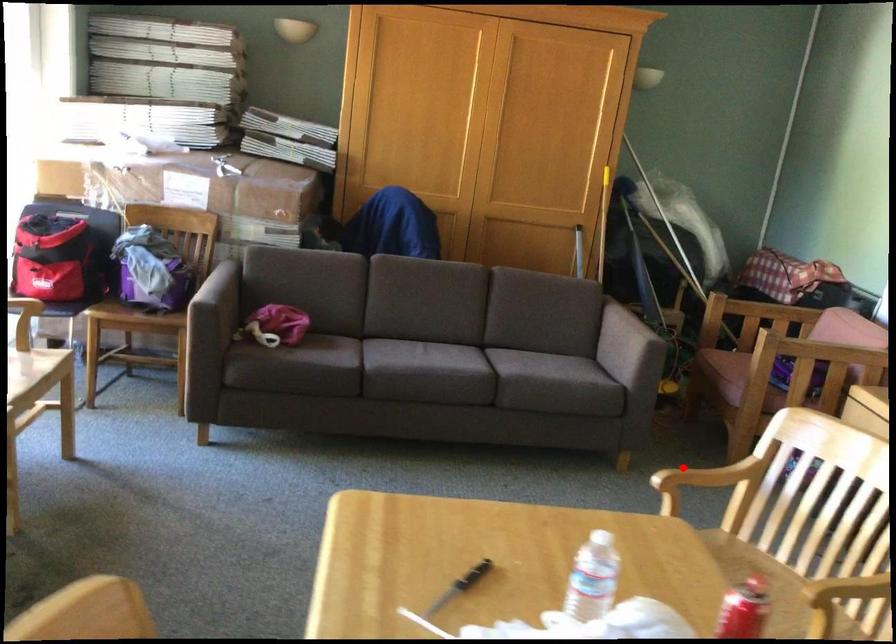
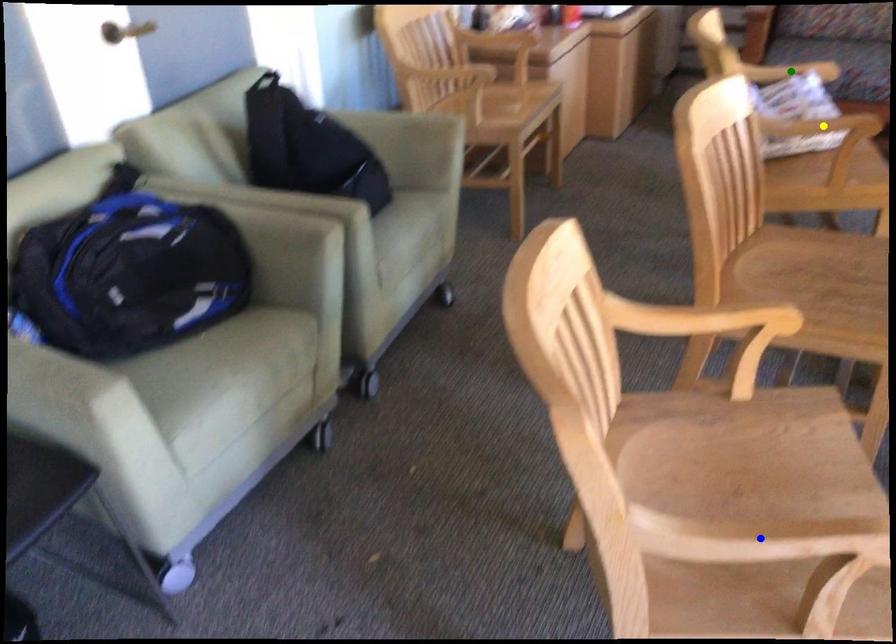
Question: I am providing you with two images of the same scene from different viewpoints. A red point is marked on the first image. You are given multiple points on the second image. In image 2, which mark is for the same physical point as the one in image 1?

Choices:
 (A) yellow point
 (B) green point
 (C) blue point

Answer: (C)